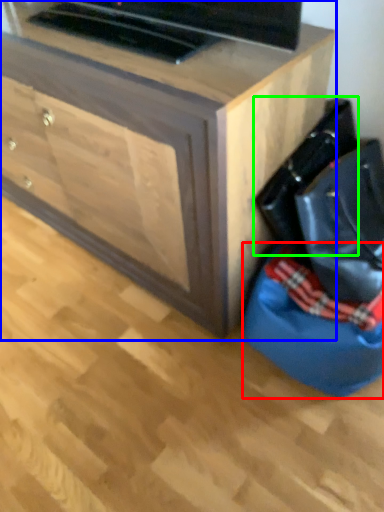
Question: Considering the real-world distances, which object is closest to bean bag chair (highlighted by a red box)? chest of drawers (highlighted by a blue box) or messenger bag (highlighted by a green box).

Choices:
 (A) chest of drawers
 (B) messenger bag

Answer: (B)